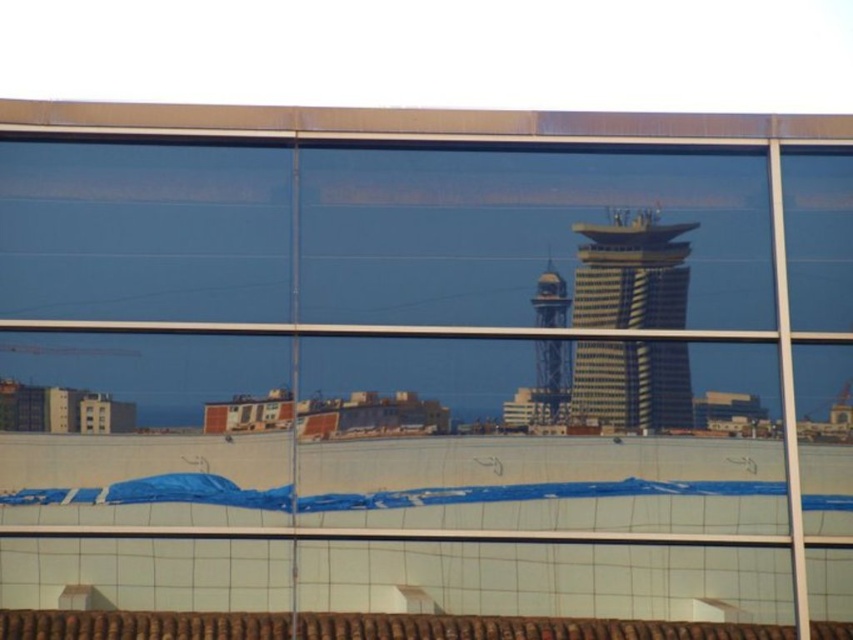
Question: Does smooth glass tower at center have a smaller size compared to shiny glass tower at center?

Choices:
 (A) no
 (B) yes

Answer: (A)

Question: Is the position of smooth glass tower at center less distant than that of shiny glass tower at center?

Choices:
 (A) yes
 (B) no

Answer: (A)

Question: Which object appears closest to the camera in this image?

Choices:
 (A) shiny glass tower at center
 (B) smooth glass tower at center

Answer: (B)

Question: In this image, where is smooth glass tower at center located relative to shiny glass tower at center?

Choices:
 (A) below
 (B) above

Answer: (B)